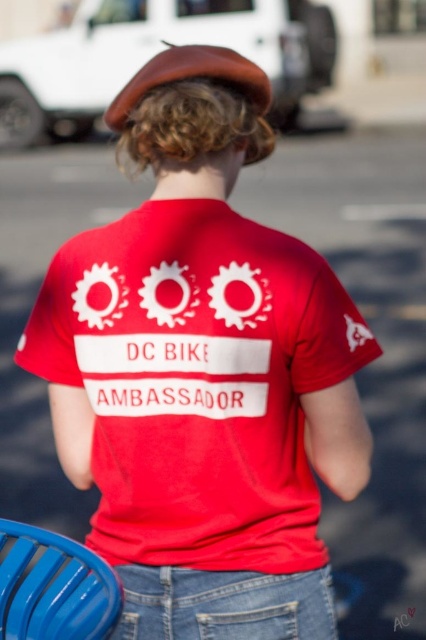
Question: Observing the image, what is the correct spatial positioning of matte red t-shirt at center in reference to denim at center?

Choices:
 (A) right
 (B) left

Answer: (B)

Question: Among these objects, which one is nearest to the camera?

Choices:
 (A) denim at center
 (B) matte red t-shirt at center
 (C) blue plastic chair at lower left

Answer: (C)

Question: Is matte red t-shirt at center above denim at center?

Choices:
 (A) yes
 (B) no

Answer: (A)

Question: Can you confirm if matte red t-shirt at center is positioned to the right of blue plastic chair at lower left?

Choices:
 (A) yes
 (B) no

Answer: (A)

Question: Which object is farther from the camera taking this photo?

Choices:
 (A) matte red t-shirt at center
 (B) blue plastic chair at lower left

Answer: (A)

Question: Among these objects, which one is nearest to the camera?

Choices:
 (A) denim at center
 (B) matte red t-shirt at center
 (C) blue plastic chair at lower left

Answer: (C)